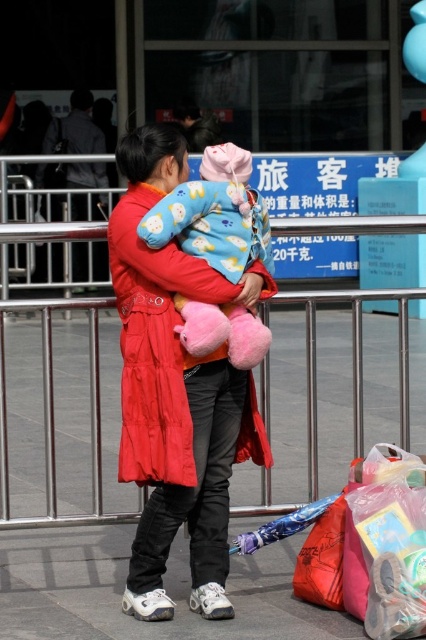
Can you confirm if metallic silver rail at center is thinner than plastic bag at lower right?

No, metallic silver rail at center is not thinner than plastic bag at lower right.

Is point (54, 502) closer to camera compared to point (293, 588)?

No, (54, 502) is further to viewer.

The width and height of the screenshot is (426, 640). Find the location of `metallic silver rail at center`. metallic silver rail at center is located at coordinates (52, 420).

Which is behind, point (164, 467) or point (46, 480)?

Point (46, 480)

At what (x,y) coordinates should I click in order to perform the action: click on matte red coat at center. Please return your answer as a coordinate pair (x, y). The height and width of the screenshot is (640, 426). Looking at the image, I should click on (176, 388).

Is point (141, 541) positioned behind point (388, 289)?

No.

Locate an element on the screen. The height and width of the screenshot is (640, 426). matte red coat at center is located at coordinates (176, 388).

Does metallic silver rail at center appear on the left side of fluffy pink plush at center?

Yes, metallic silver rail at center is to the left of fluffy pink plush at center.

Is metallic silver rail at center above fluffy pink plush at center?

No, metallic silver rail at center is not above fluffy pink plush at center.

Find the location of a particular element. metallic silver rail at center is located at coordinates (52, 420).

This screenshot has height=640, width=426. I want to click on metallic silver rail at center, so click(52, 420).